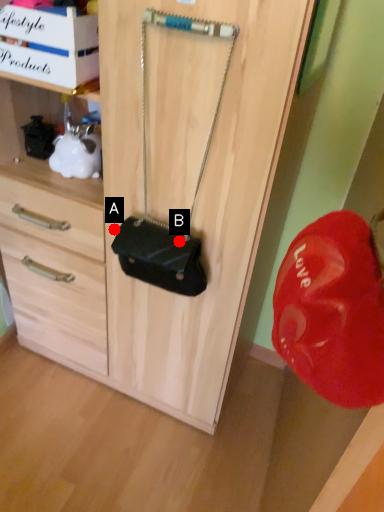
Question: Two points are circled on the image, labeled by A and B beside each circle. Which point is further to the camera?

Choices:
 (A) A is further
 (B) B is further

Answer: (A)